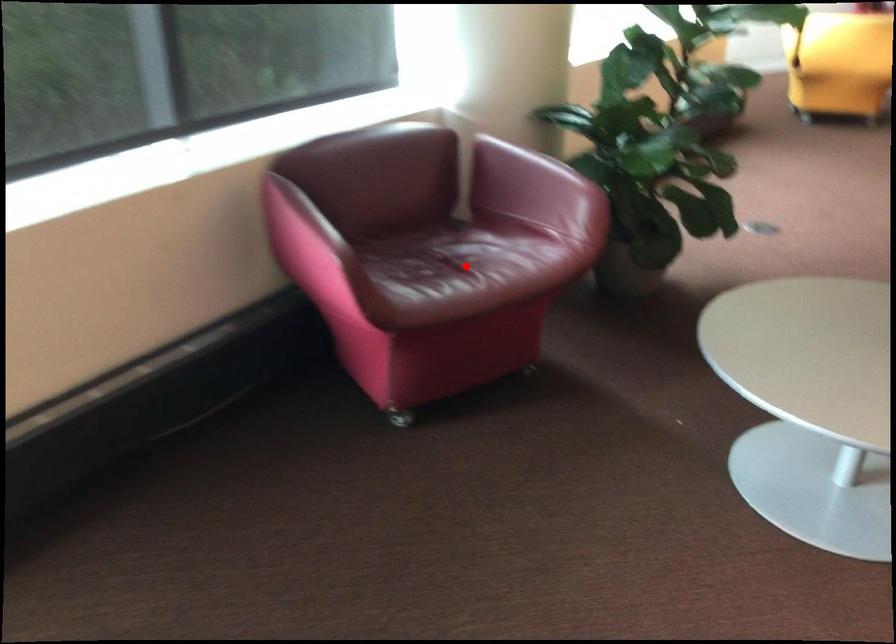
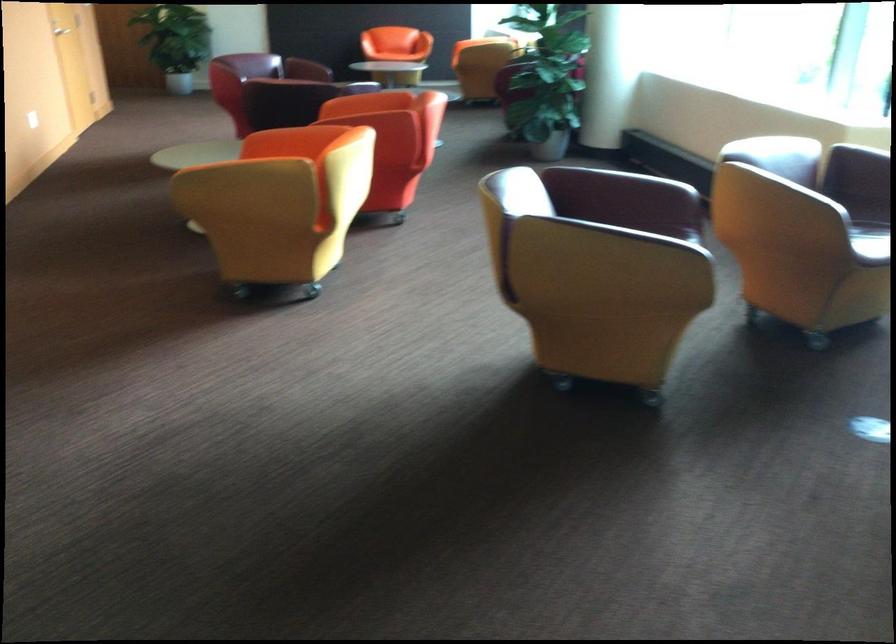
Question: I am providing you with two images of the same scene from different viewpoints. A red point is marked on the first image. Is the red point's position out of view in image 2?

Choices:
 (A) Yes
 (B) No

Answer: (A)